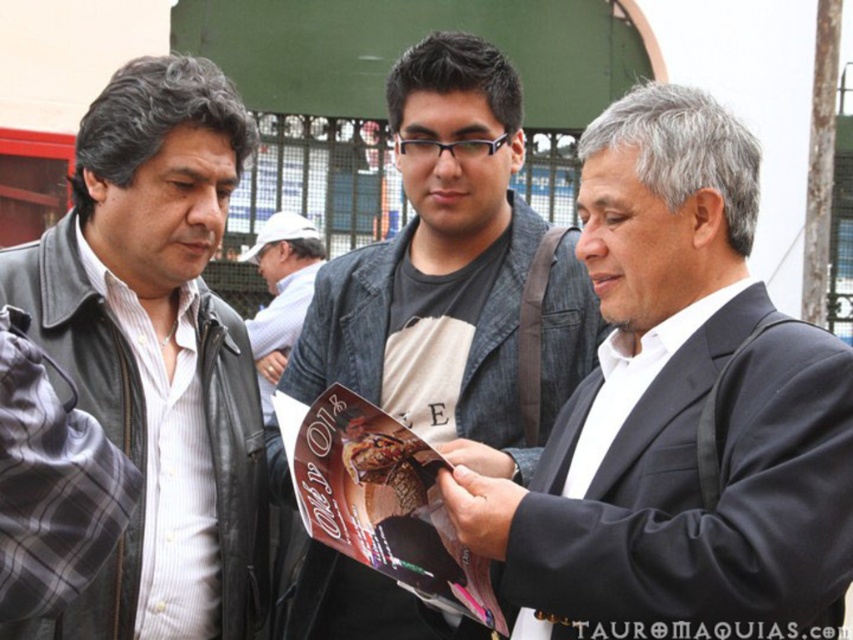
Which of these two, black suit jacket at center or denim jacket at center, stands shorter?

With less height is black suit jacket at center.

Is point (585, 131) in front of point (544, 380)?

No, it is behind (544, 380).

Does point (670, 243) lie behind point (444, 348)?

That is False.

Find the location of a particular element. This screenshot has height=640, width=853. black suit jacket at center is located at coordinates (676, 408).

Between denim jacket at center and light gray fabric shirt at center, which one appears on the right side from the viewer's perspective?

denim jacket at center is more to the right.

This screenshot has height=640, width=853. What do you see at coordinates (456, 276) in the screenshot? I see `denim jacket at center` at bounding box center [456, 276].

Between point (334, 323) and point (276, 332), which one is positioned in front?

Point (334, 323) is in front.

In order to click on denim jacket at center in this screenshot , I will do click(x=456, y=276).

Is point (793, 408) less distant than point (334, 392)?

Yes, it is in front of point (334, 392).

Between point (758, 445) and point (316, 508), which one is positioned in front?

Point (758, 445) is in front.

Where is `black suit jacket at center`? This screenshot has width=853, height=640. black suit jacket at center is located at coordinates (676, 408).